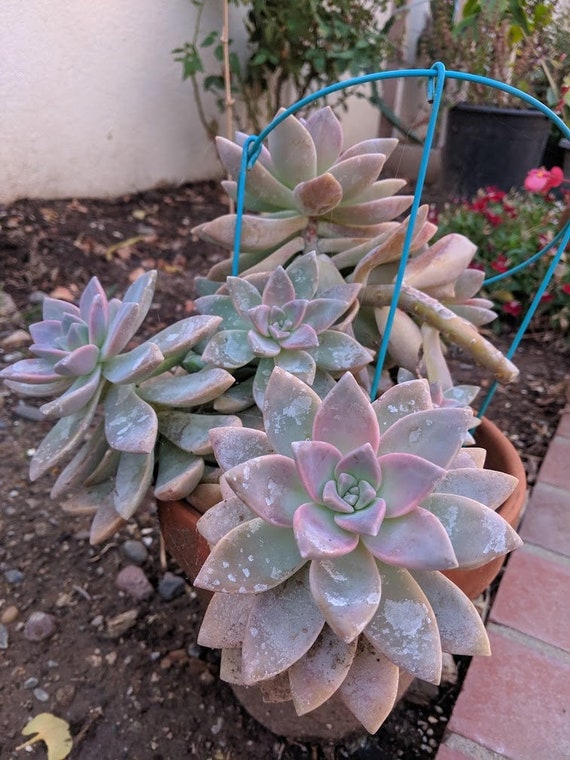
Locate an element on the screen. Image resolution: width=570 pixels, height=760 pixels. flower pot is located at coordinates (185, 526).